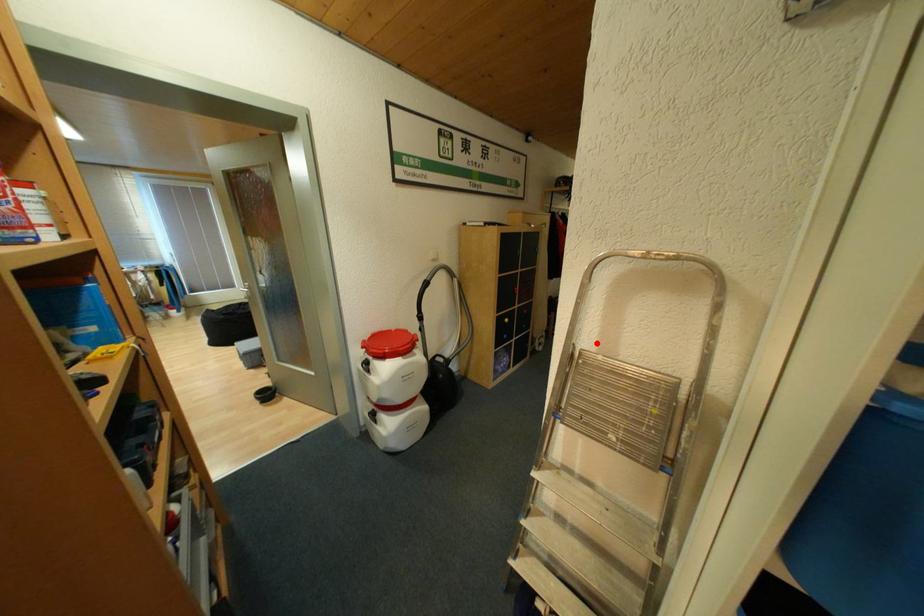
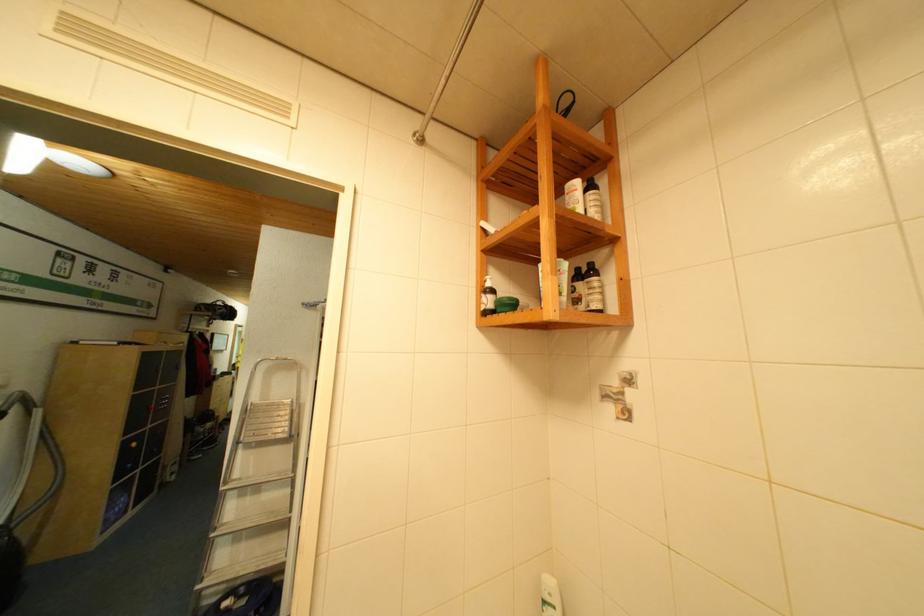
Question: I am providing you with two images of the same scene from different viewpoints. A red point is marked on the first image. At the location where the point appears in image 1, is it still visible in image 2?

Choices:
 (A) Yes
 (B) No

Answer: (A)